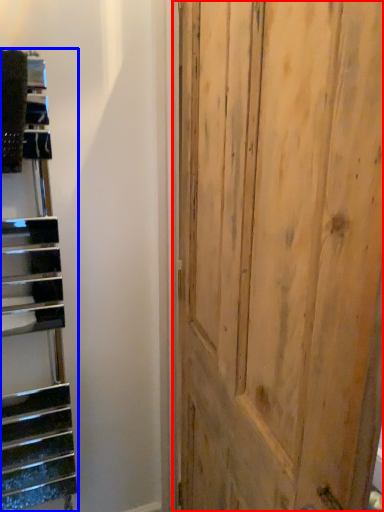
Question: Among these objects, which one is nearest to the camera, door (highlighted by a red box) or stairwell (highlighted by a blue box)?

Choices:
 (A) door
 (B) stairwell

Answer: (A)